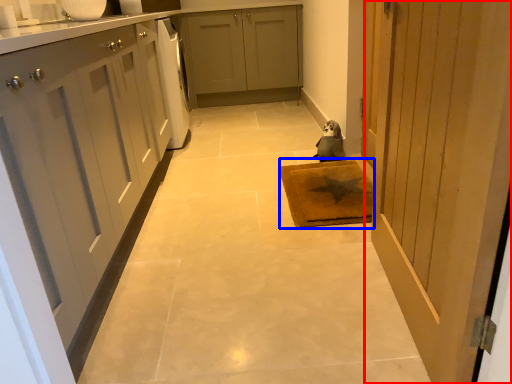
Question: Which object appears closest to the camera in this image, door (highlighted by a red box) or mat (highlighted by a blue box)?

Choices:
 (A) door
 (B) mat

Answer: (A)